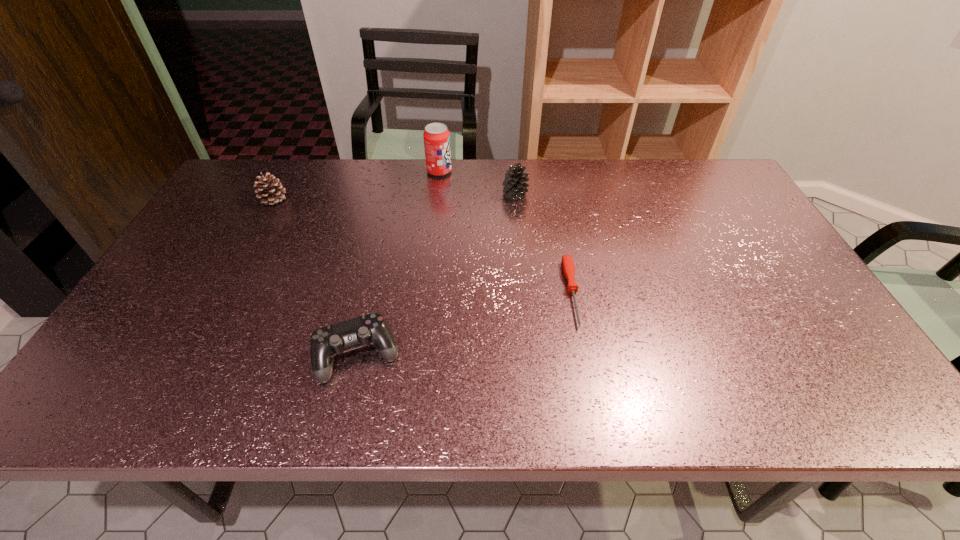
Locate an element on the screen. free space located on the front of the right pinecone is located at coordinates (517, 221).

Locate an element on the screen. free space located on the back of the left pinecone is located at coordinates (285, 180).

Find the location of a particular element. The image size is (960, 540). vacant space located 0.350m on the left of the control is located at coordinates (158, 355).

The width and height of the screenshot is (960, 540). I want to click on vacant point located 0.060m at the tip of the rightmost object, so pos(583,351).

The image size is (960, 540). What are the coordinates of `soda can that is at the far edge` in the screenshot? It's located at (436, 136).

You are a GUI agent. You are given a task and a screenshot of the screen. Output one action in this format:
    pyautogui.click(x=<x>, y=<y>)
    Task: Click on the object located at the near edge
    The image size is (960, 540).
    Given the screenshot: What is the action you would take?
    pyautogui.click(x=325, y=342)

Where is `object located at the left edge`? object located at the left edge is located at coordinates 272,191.

You are a GUI agent. You are given a task and a screenshot of the screen. Output one action in this format:
    pyautogui.click(x=<x>, y=<y>)
    Task: Click on the object present at the far left corner
    This screenshot has height=540, width=960.
    Given the screenshot: What is the action you would take?
    pyautogui.click(x=272, y=191)

Image resolution: width=960 pixels, height=540 pixels. Find the location of `vacant space at the far edge of the desktop`. vacant space at the far edge of the desktop is located at coordinates (612, 165).

Locate an element on the screen. This screenshot has width=960, height=540. free space at the near edge of the desktop is located at coordinates (521, 413).